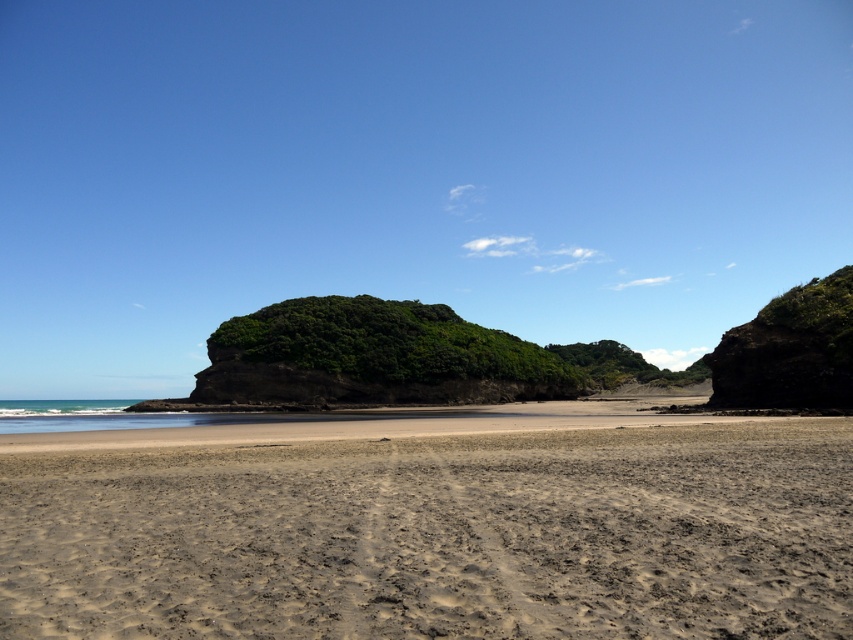
Question: Can you confirm if brown sandy beach at center is positioned to the left of dark brown rocky cliff at right?

Choices:
 (A) yes
 (B) no

Answer: (A)

Question: Which object appears farthest from the camera in this image?

Choices:
 (A) brown sandy beach at center
 (B) dark brown rocky cliff at right

Answer: (B)

Question: Is the position of brown sandy beach at center more distant than that of dark brown rocky cliff at right?

Choices:
 (A) no
 (B) yes

Answer: (A)

Question: Which point is farther to the camera?

Choices:
 (A) (787, 346)
 (B) (114, 557)

Answer: (A)

Question: Is brown sandy beach at center below dark brown rocky cliff at right?

Choices:
 (A) no
 (B) yes

Answer: (B)